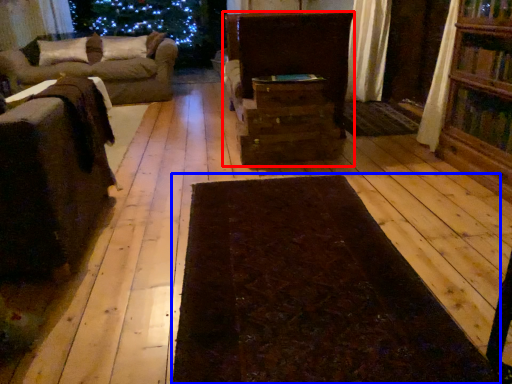
Question: Among these objects, which one is nearest to the camera, furniture (highlighted by a red box) or mat (highlighted by a blue box)?

Choices:
 (A) furniture
 (B) mat

Answer: (B)